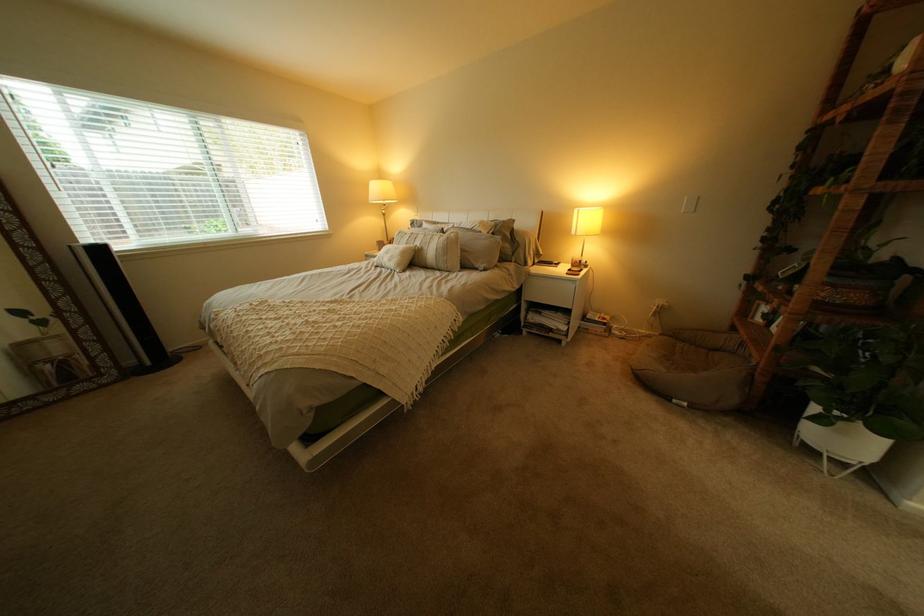
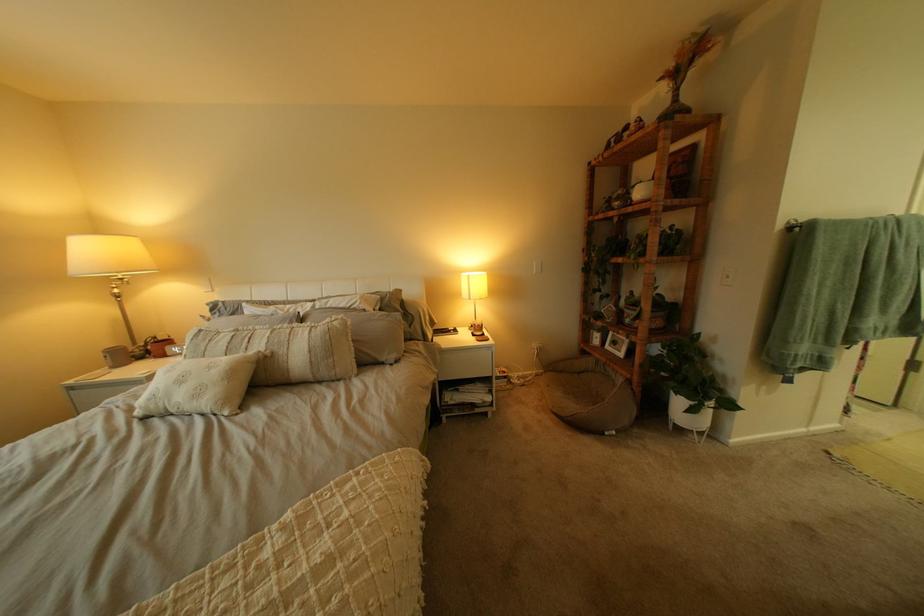
The point at (435,243) is marked in the first image. Where is the corresponding point in the second image?

(281, 342)